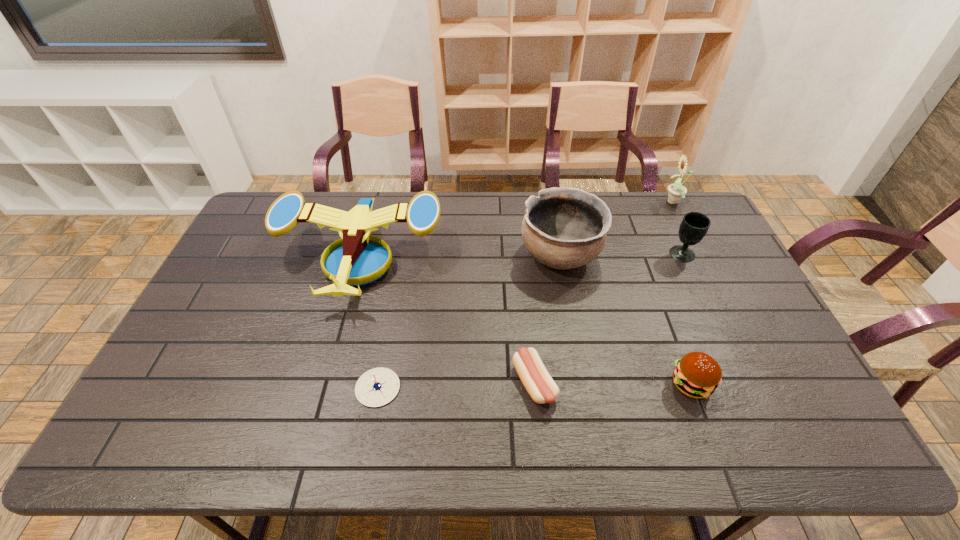
At what (x,y) coordinates should I click in order to perform the action: click on unoccupied position between the sausage and the farthest object. Please return your answer as a coordinate pair (x, y). The width and height of the screenshot is (960, 540). Looking at the image, I should click on (604, 293).

Find the location of a particular element. This screenshot has width=960, height=540. free spot between the farthest object and the pottery is located at coordinates (617, 229).

The height and width of the screenshot is (540, 960). I want to click on unoccupied area between the compass and the sunflower, so click(526, 295).

Locate an element on the screen. The image size is (960, 540). free space between the compass and the sunflower is located at coordinates (526, 295).

The height and width of the screenshot is (540, 960). I want to click on unoccupied position between the sausage and the chalice, so click(x=609, y=319).

Image resolution: width=960 pixels, height=540 pixels. What are the coordinates of `vacant space that's between the sausage and the pottery` in the screenshot? It's located at (547, 320).

Identify the location of vacant area between the hamburger and the sausage. This screenshot has width=960, height=540. tap(612, 383).

The height and width of the screenshot is (540, 960). What are the coordinates of `vacant space that is in between the sausage and the pottery` in the screenshot? It's located at (547, 320).

You are a GUI agent. You are given a task and a screenshot of the screen. Output one action in this format:
    pyautogui.click(x=<x>, y=<y>)
    Task: Click on the empty space that is in between the sausage and the chalice
    
    Given the screenshot: What is the action you would take?
    pyautogui.click(x=609, y=319)

Locate an element on the screen. The height and width of the screenshot is (540, 960). object that ranks as the fifth closest to the chalice is located at coordinates (357, 260).